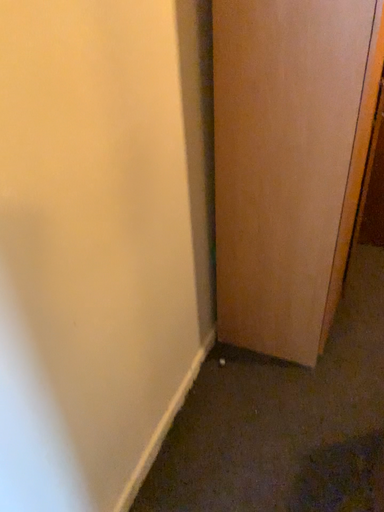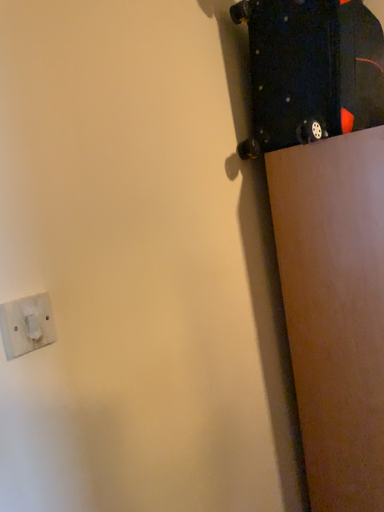
Question: Which way did the camera rotate in the video?

Choices:
 (A) rotated upward
 (B) rotated downward

Answer: (A)